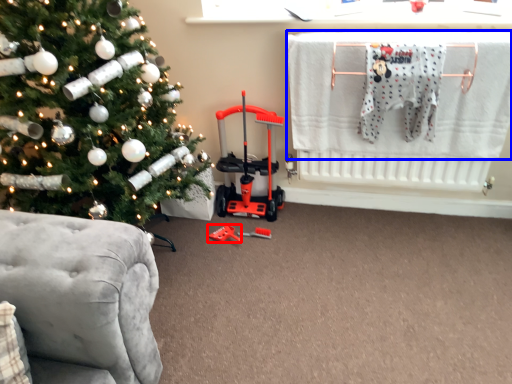
Question: Which object appears farthest to the camera in this image, toy (highlighted by a red box) or laundry (highlighted by a blue box)?

Choices:
 (A) toy
 (B) laundry

Answer: (A)